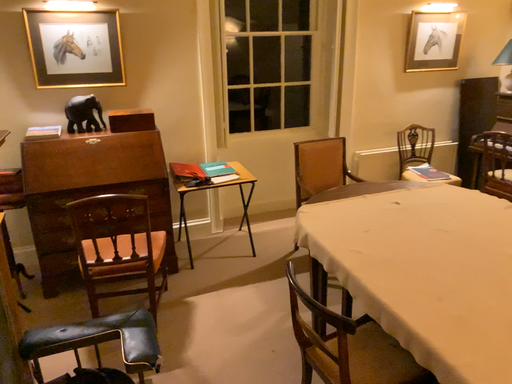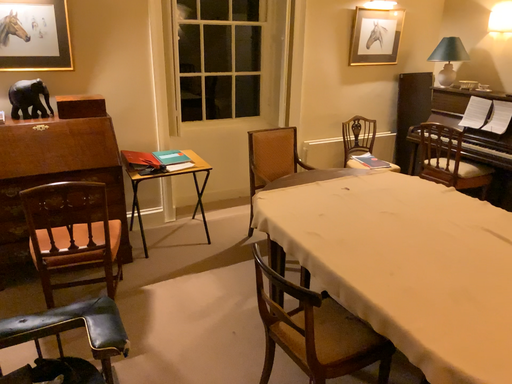
Question: Which way did the camera rotate in the video?

Choices:
 (A) rotated right
 (B) rotated left

Answer: (A)